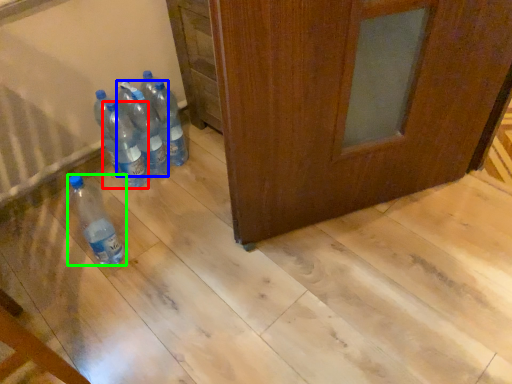
Question: Which is nearer to the bottle (highlighted by a red box)? bottle (highlighted by a blue box) or bottle (highlighted by a green box).

Choices:
 (A) bottle
 (B) bottle

Answer: (A)